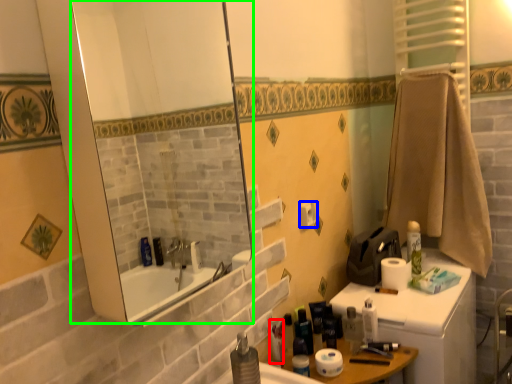
Question: Which is farther away from toiletry (highlighted by a red box)? toilet paper (highlighted by a blue box) or mirror (highlighted by a green box)?

Choices:
 (A) toilet paper
 (B) mirror

Answer: (B)